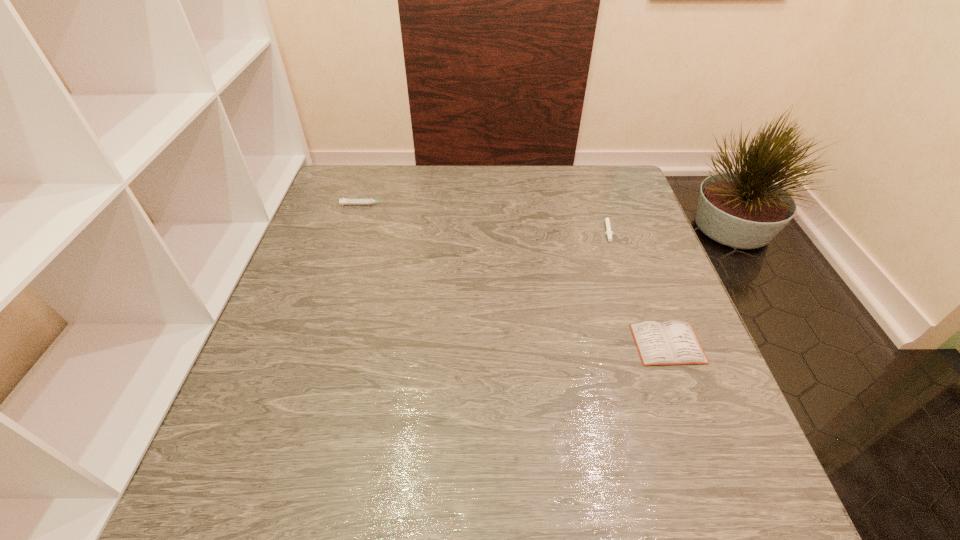
Where is `object that can be found as the closest to the farther syringe`? object that can be found as the closest to the farther syringe is located at coordinates [608, 232].

Identify the location of free space that satisfies the following two spatial constraints: 1. at the needle end of the nearer syringe; 2. on the left side of the farther syringe. (x=358, y=227).

Find the location of a particular element. vacant space that satisfies the following two spatial constraints: 1. on the back side of the nearer syringe; 2. at the needle end of the farther syringe is located at coordinates (599, 205).

In order to click on free space that satisfies the following two spatial constraints: 1. at the needle end of the right syringe; 2. on the right side of the left syringe in this screenshot , I will do `click(358, 227)`.

Where is `free spot that satisfies the following two spatial constraints: 1. at the needle end of the shorter syringe; 2. on the right side of the tallest object`? free spot that satisfies the following two spatial constraints: 1. at the needle end of the shorter syringe; 2. on the right side of the tallest object is located at coordinates (358, 227).

Find the location of a particular element. The width and height of the screenshot is (960, 540). blank area in the image that satisfies the following two spatial constraints: 1. at the needle end of the leftmost object; 2. on the back side of the nearest object is located at coordinates (322, 343).

Identify the location of free location that satisfies the following two spatial constraints: 1. at the needle end of the right syringe; 2. on the left side of the leftmost object. The height and width of the screenshot is (540, 960). (358, 227).

Identify the location of free point that satisfies the following two spatial constraints: 1. at the needle end of the left syringe; 2. on the left side of the nearest object. (322, 343).

Where is `blank space that satisfies the following two spatial constraints: 1. at the needle end of the tallest object; 2. on the right side of the nearer syringe`? The width and height of the screenshot is (960, 540). blank space that satisfies the following two spatial constraints: 1. at the needle end of the tallest object; 2. on the right side of the nearer syringe is located at coordinates (358, 227).